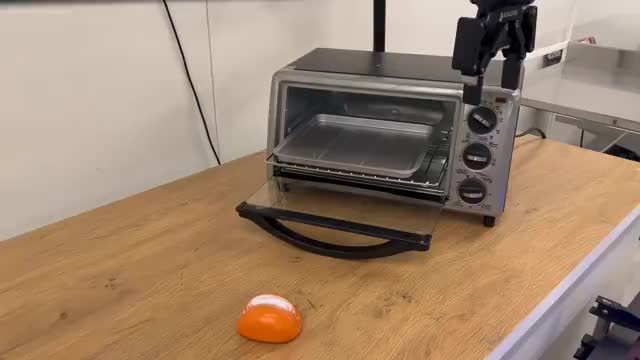
Identify the location of doors. The image size is (640, 360). (397, 220).